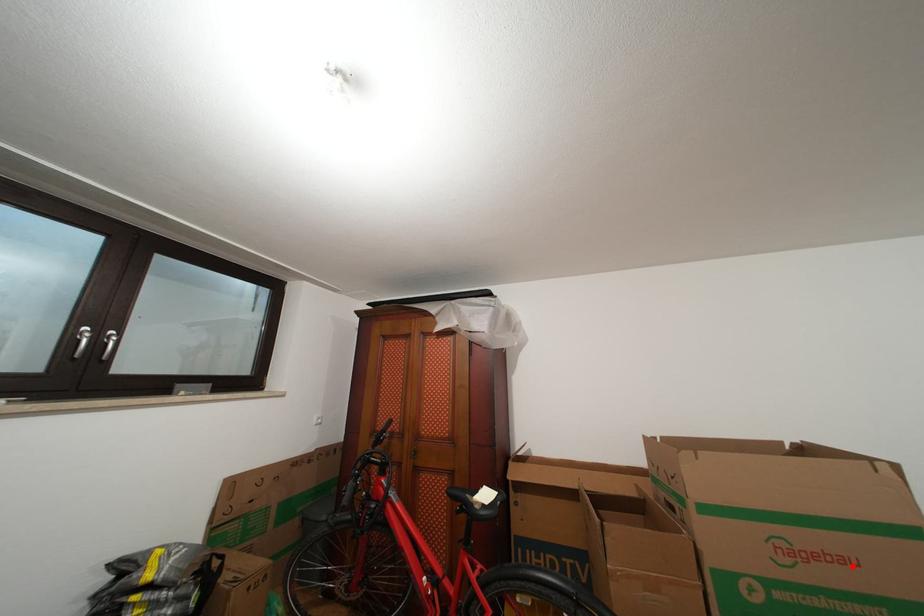
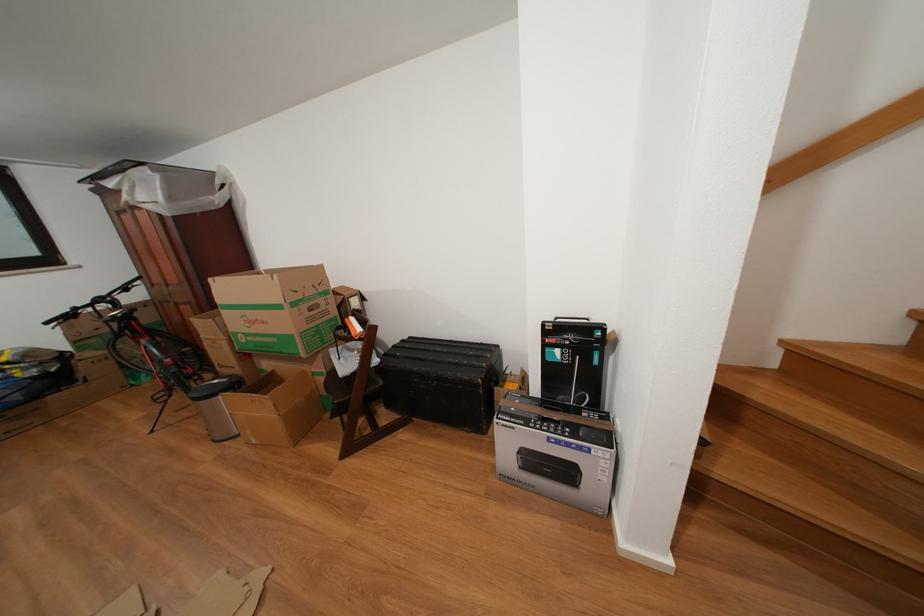
Question: A red point is marked in image1. In image2, is the corresponding 3D point closer to the camera or farther? Reply with the corresponding letter.

Choices:
 (A) The corresponding 3D point is closer.
 (B) The corresponding 3D point is farther.

Answer: (B)